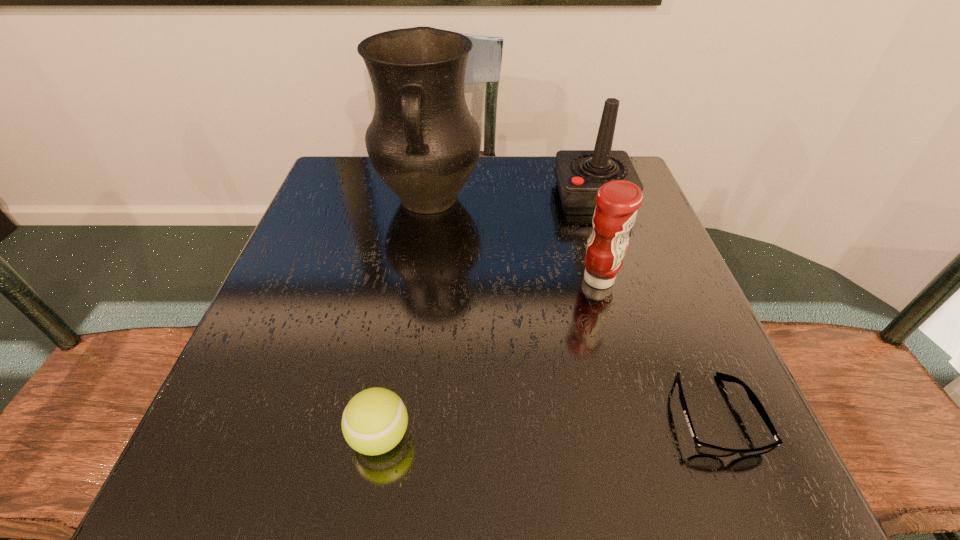
At what (x,y) coordinates should I click in order to perform the action: click on the tallest object. Please return your answer as a coordinate pair (x, y). Image resolution: width=960 pixels, height=540 pixels. Looking at the image, I should click on (423, 142).

At what (x,y) coordinates should I click in order to perform the action: click on joystick. Please return your answer as a coordinate pair (x, y). This screenshot has height=540, width=960. Looking at the image, I should click on (x=579, y=174).

At what (x,y) coordinates should I click in order to perform the action: click on the third shortest object. Please return your answer as a coordinate pair (x, y). Looking at the image, I should click on (618, 201).

The width and height of the screenshot is (960, 540). Find the location of `the third farthest object`. the third farthest object is located at coordinates (618, 201).

Find the location of a particular element. tennis ball is located at coordinates (375, 420).

At what (x,y) coordinates should I click in order to perform the action: click on sunglasses. Please return your answer as a coordinate pair (x, y). Looking at the image, I should click on (702, 448).

Locate an element on the screen. The height and width of the screenshot is (540, 960). free space located on the handle side of the tallest object is located at coordinates (404, 367).

The image size is (960, 540). What are the coordinates of `blank space located on the front-facing side of the joystick` in the screenshot? It's located at (449, 196).

Locate an element on the screen. vacant space located on the front-facing side of the joystick is located at coordinates (507, 196).

Image resolution: width=960 pixels, height=540 pixels. Identify the location of vacant region located on the front-facing side of the joystick. (491, 196).